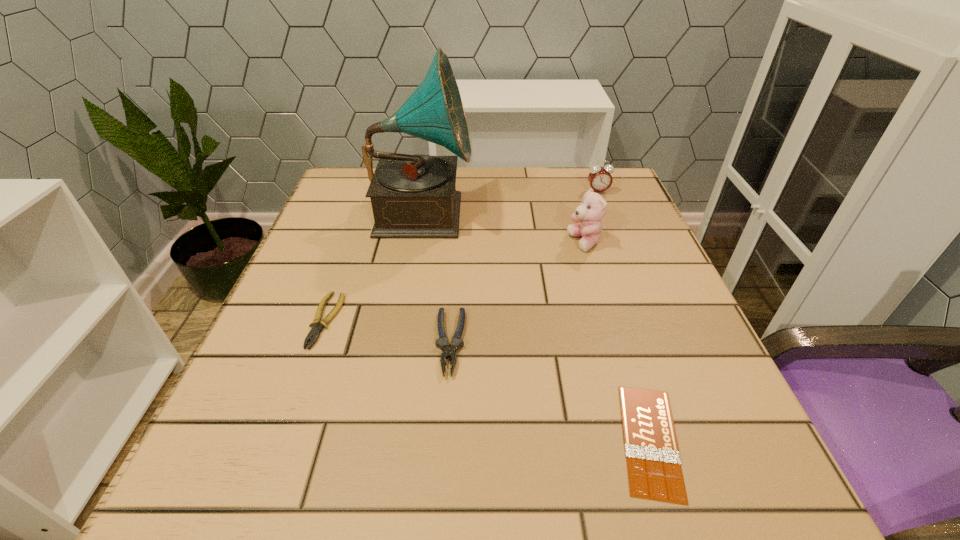
The width and height of the screenshot is (960, 540). Find the location of `record player located in the left edge section of the desktop`. record player located in the left edge section of the desktop is located at coordinates (413, 196).

Find the location of a particular element. This screenshot has height=540, width=960. pliers present at the left edge is located at coordinates (317, 325).

I want to click on teddy bear that is at the right edge, so click(x=591, y=211).

The width and height of the screenshot is (960, 540). What are the coordinates of `alarm clock located at the right edge` in the screenshot? It's located at [x=600, y=179].

Where is `chocolate bar that is at the right edge`? chocolate bar that is at the right edge is located at coordinates (654, 469).

Image resolution: width=960 pixels, height=540 pixels. What are the coordinates of `object present at the far left corner` in the screenshot? It's located at coord(413,196).

The image size is (960, 540). Identify the location of object located at the far right corner. (600, 179).

At what (x,y) coordinates should I click in order to perform the action: click on object situated at the near right corner. Please return your answer as a coordinate pair (x, y). The height and width of the screenshot is (540, 960). Looking at the image, I should click on (654, 469).

In the image, there is a desktop. Where is `free space at the near edge`? The image size is (960, 540). free space at the near edge is located at coordinates (421, 508).

The height and width of the screenshot is (540, 960). What are the coordinates of `vacant space at the left edge` in the screenshot? It's located at (281, 448).